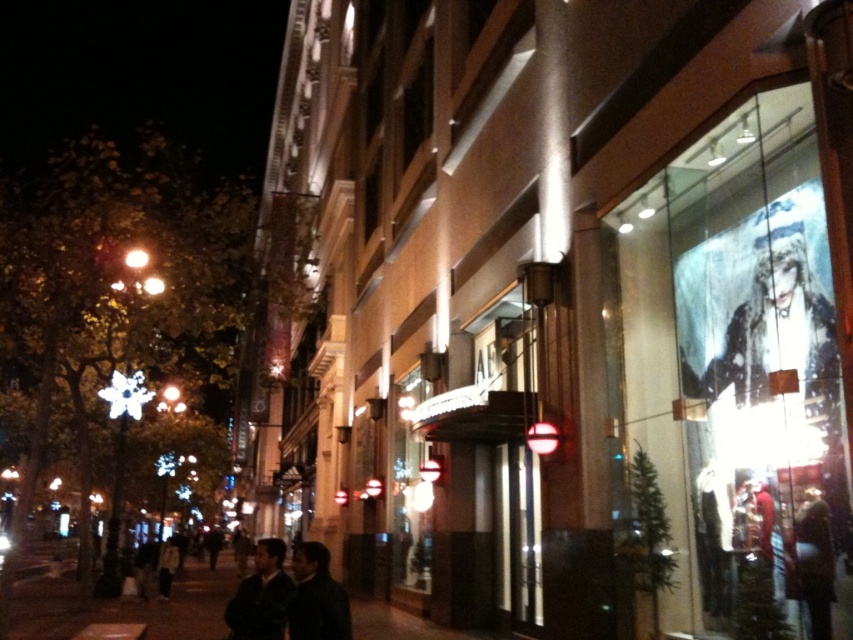
You are standing on the street and see two points marked in the image. Which point is closer to you, point (283, 605) or point (309, 602)?

Point (309, 602) is closer to you because it is in front of point (283, 605).

You are a fashion photographer who wants to capture both the dark green leather jackets at center and the dark gray jacket at center in a single frame. Which jacket should you focus on first to ensure both are in the shot?

The dark green leather jackets at center is above the dark gray jacket at center, so focusing on the dark green leather jackets at center first will ensure both are in the shot.

You are a delivery person standing on the dark asphalt pavement at lower center and need to place a package under the dark green leather jackets at center. Can you place the package directly underneath them?

The dark asphalt pavement at lower center is positioned under the dark green leather jackets at center, so yes, you can place the package directly underneath them.